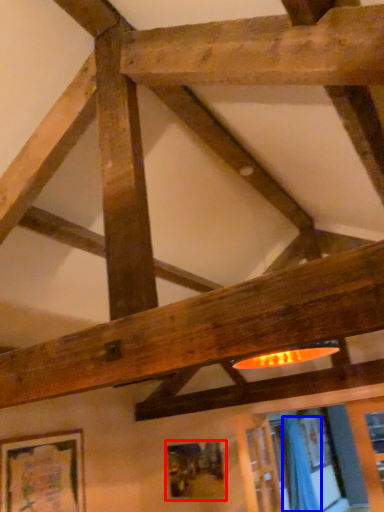
Question: Among these objects, which one is nearest to the camera, picture frame (highlighted by a red box) or curtain (highlighted by a blue box)?

Choices:
 (A) picture frame
 (B) curtain

Answer: (A)